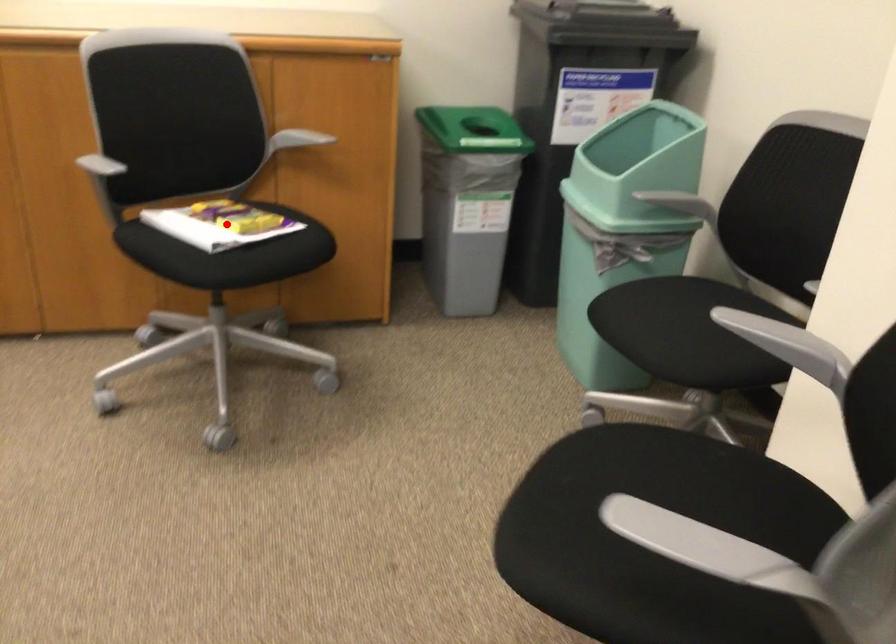
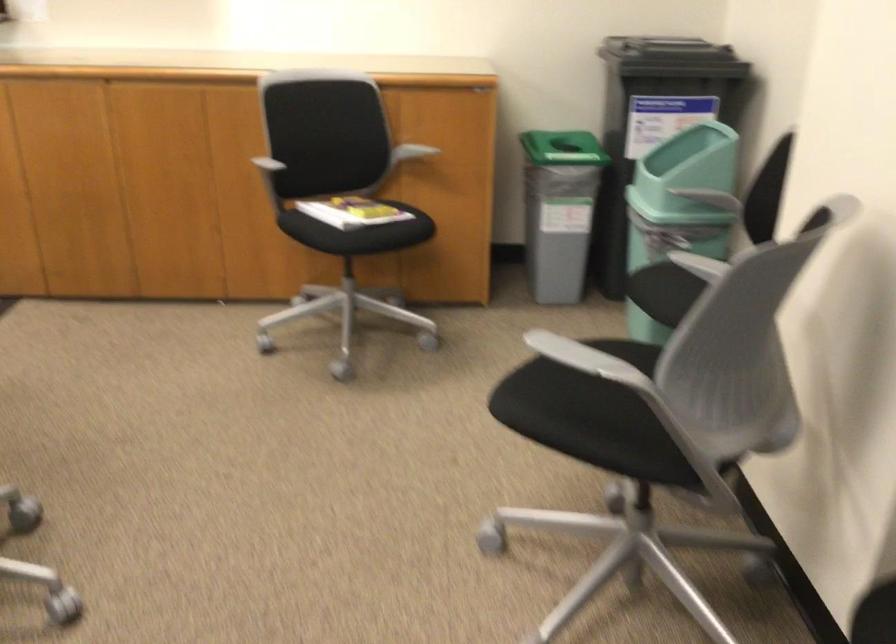
Question: I am providing you with two images of the same scene from different viewpoints. Given a red point in image1, look at the same physical point in image2. Is it:

Choices:
 (A) Closer to the viewpoint
 (B) Farther from the viewpoint

Answer: (B)